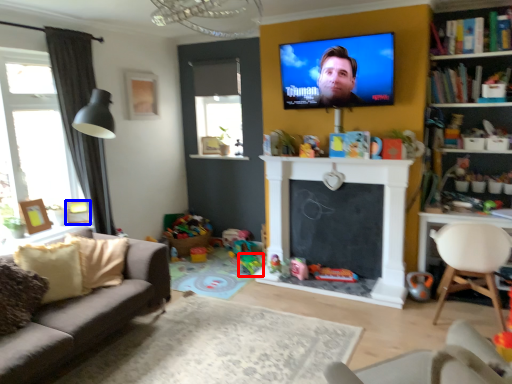
Question: Which point is closer to the camera, toy (highlighted by a red box) or picture frame (highlighted by a blue box)?

Choices:
 (A) toy
 (B) picture frame

Answer: (B)